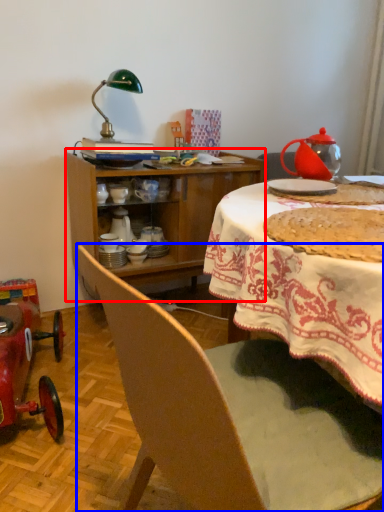
Question: Which object is closer to the camera taking this photo, cabinetry (highlighted by a red box) or chair (highlighted by a blue box)?

Choices:
 (A) cabinetry
 (B) chair

Answer: (B)